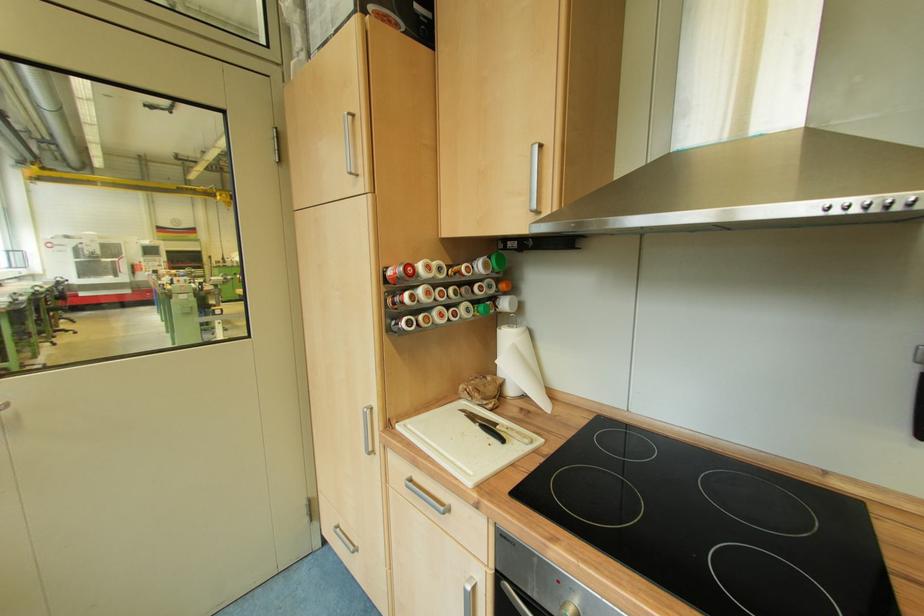
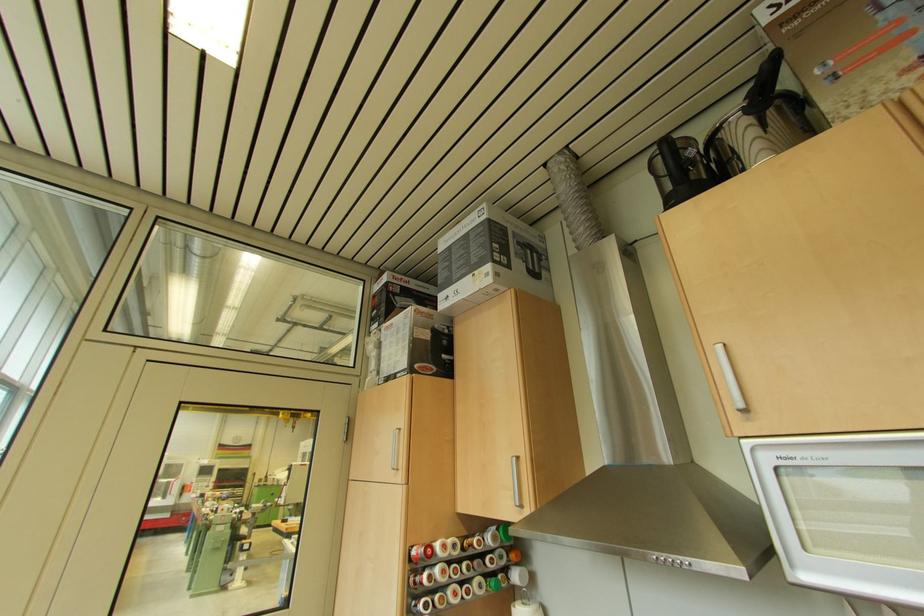
Find the pixel in the second image that matches [186,284] in the first image.

(229, 513)